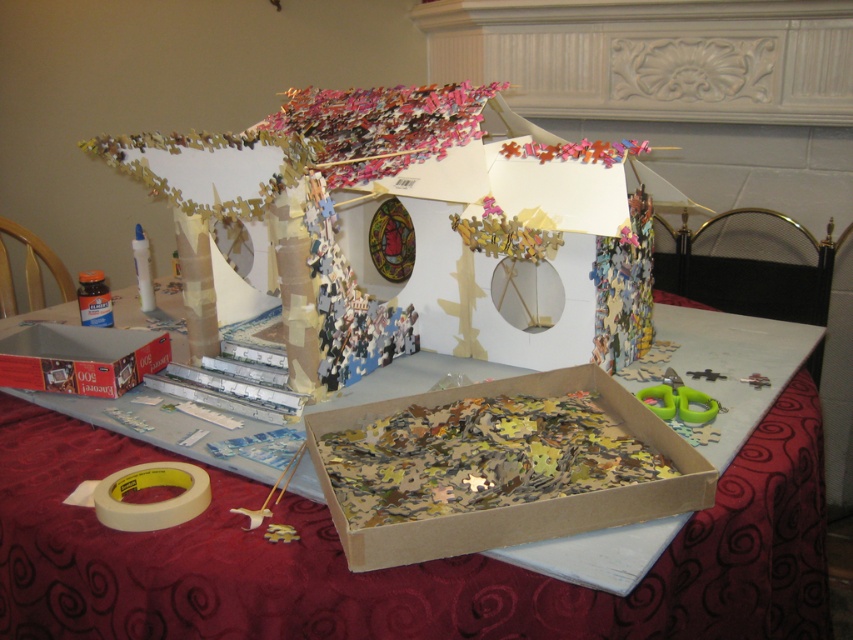
Is cardboard puzzle pieces at center positioned in front of metallic cardboard box at lower left?

Yes.

Is cardboard puzzle pieces at center to the left of metallic cardboard box at lower left from the viewer's perspective?

No, cardboard puzzle pieces at center is not to the left of metallic cardboard box at lower left.

Does point (349, 528) come closer to viewer compared to point (109, 355)?

Yes, point (349, 528) is in front of point (109, 355).

Locate an element on the screen. This screenshot has width=853, height=640. cardboard puzzle pieces at center is located at coordinates (498, 467).

Which is below, wooden puzzle pieces at center or metallic cardboard box at lower left?

wooden puzzle pieces at center is lower down.

Can you confirm if wooden puzzle pieces at center is wider than metallic cardboard box at lower left?

Indeed, wooden puzzle pieces at center has a greater width compared to metallic cardboard box at lower left.

Is point (108, 456) farther from camera compared to point (117, 339)?

That is False.

Find the location of a particular element. wooden puzzle pieces at center is located at coordinates (x=395, y=566).

Who is lower down, wooden puzzle pieces at center or cardboard puzzle pieces at center?

wooden puzzle pieces at center is lower down.

Measure the distance between wooden puzzle pieces at center and camera.

They are 90.82 centimeters apart.

Find the location of a particular element. The image size is (853, 640). wooden puzzle pieces at center is located at coordinates (395, 566).